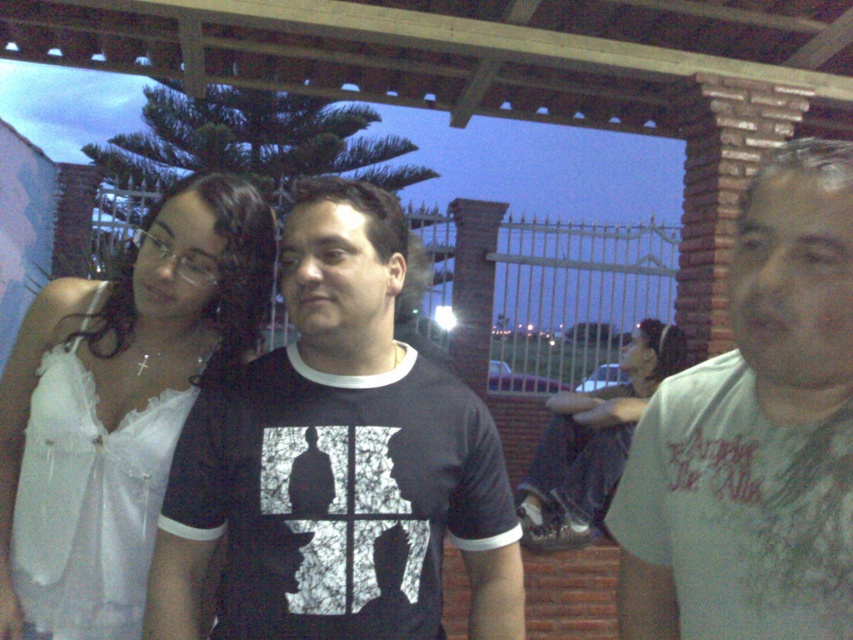
Question: Can you confirm if white cotton t-shirt at right is bigger than jeans at lower right?

Choices:
 (A) no
 (B) yes

Answer: (A)

Question: Does black matte t-shirt at center have a lesser width compared to white cotton t-shirt at right?

Choices:
 (A) yes
 (B) no

Answer: (B)

Question: Which object is closer to the camera taking this photo?

Choices:
 (A) black matte t-shirt at center
 (B) white satin blouse at left
 (C) jeans at lower right

Answer: (A)

Question: Among these points, which one is farthest from the camera?

Choices:
 (A) (845, 220)
 (B) (303, 406)

Answer: (B)

Question: Can you confirm if black matte t-shirt at center is thinner than jeans at lower right?

Choices:
 (A) no
 (B) yes

Answer: (B)

Question: Which point is closer to the camera?

Choices:
 (A) white cotton t-shirt at right
 (B) jeans at lower right

Answer: (A)